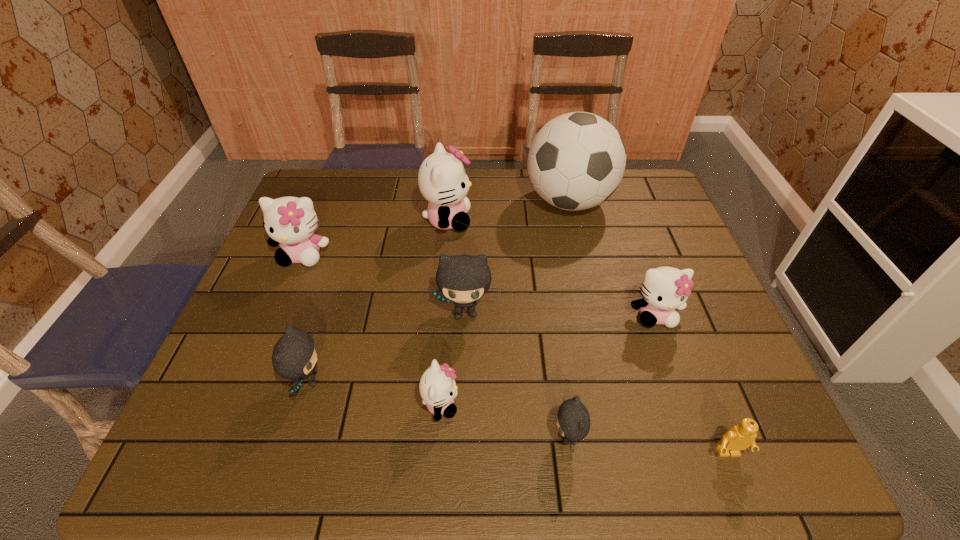
Find the location of `object that is at the near right corner`. object that is at the near right corner is located at coordinates (740, 437).

The height and width of the screenshot is (540, 960). I want to click on vacant space at the far edge of the desktop, so click(x=532, y=199).

This screenshot has height=540, width=960. I want to click on free region at the near edge of the desktop, so click(265, 465).

Locate an element on the screen. This screenshot has width=960, height=540. free location at the left edge of the desktop is located at coordinates (289, 313).

At what (x,y) coordinates should I click in order to perform the action: click on vacant space at the far left corner. Please return your answer as a coordinate pair (x, y). Looking at the image, I should click on (310, 172).

What are the coordinates of `vacant space at the far right corner` in the screenshot? It's located at (654, 196).

This screenshot has width=960, height=540. I want to click on vacant point located between the tallest kitten and the second biggest gray kitten, so click(377, 300).

Image resolution: width=960 pixels, height=540 pixels. Identify the location of vacant space that's between the second biggest gray kitten and the smallest white kitten. (374, 392).

You are a GUI agent. You are given a task and a screenshot of the screen. Output one action in this format:
    pyautogui.click(x=<x>, y=<y>)
    Task: Click on the unoccupied area between the black soccer ball and the sixth kitten from left to right
    
    Given the screenshot: What is the action you would take?
    pyautogui.click(x=568, y=320)

You are a GUI agent. You are given a task and a screenshot of the screen. Output one action in this format:
    pyautogui.click(x=<x>, y=<y>)
    Task: Click on the vacant point located between the rightmost white kitten and the leftmost gray kitten
    
    Given the screenshot: What is the action you would take?
    481,348